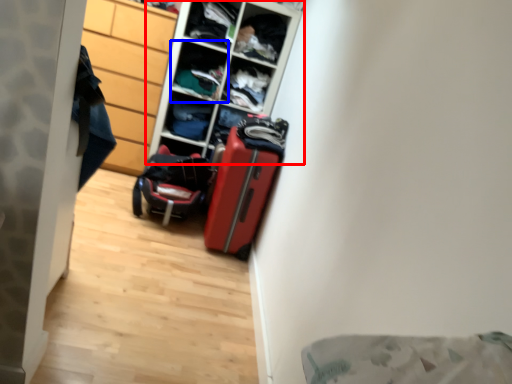
Question: Among these objects, which one is nearest to the camera, shelf (highlighted by a red box) or shelf (highlighted by a blue box)?

Choices:
 (A) shelf
 (B) shelf

Answer: (A)